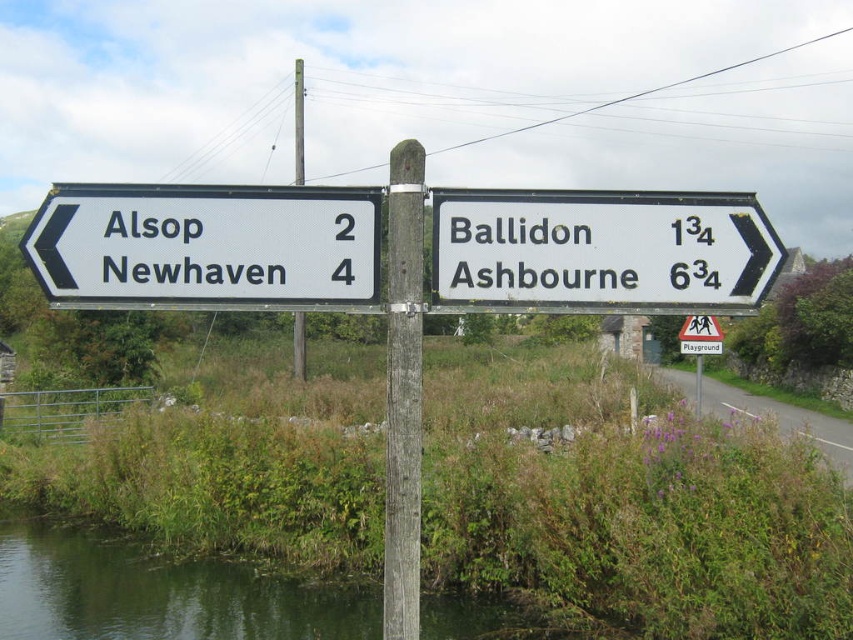
You are standing at the intersection near the waterway and see the white plastic sign at left. If you want to go to Ballidon, which direction should you choose based on the signpost?

The white plastic sign at left points to Alsop and Newhaven, so to go to Ballidon you should look for the other sign on the signpost which is not mentioned on the white plastic sign at left.